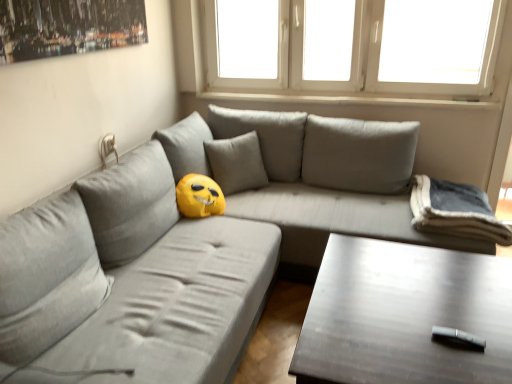
Question: Is gray fabric couch at center positioned with its back to gray fleece blanket at right, positioned as the 2th pillow in left-to-right order?

Choices:
 (A) no
 (B) yes

Answer: (A)

Question: Is gray fabric couch at center further to the viewer compared to gray fleece blanket at right, positioned as the 2th pillow in left-to-right order?

Choices:
 (A) yes
 (B) no

Answer: (B)

Question: Considering the relative positions of gray fabric couch at center and gray fleece blanket at right, the 1th pillow in the right-to-left sequence, in the image provided, is gray fabric couch at center to the left of gray fleece blanket at right, the 1th pillow in the right-to-left sequence, from the viewer's perspective?

Choices:
 (A) yes
 (B) no

Answer: (A)

Question: Considering the relative sizes of gray fabric couch at center and gray fleece blanket at right, the 1th pillow in the right-to-left sequence, in the image provided, is gray fabric couch at center wider than gray fleece blanket at right, the 1th pillow in the right-to-left sequence,?

Choices:
 (A) yes
 (B) no

Answer: (A)

Question: Would you say gray fleece blanket at right, positioned as the 2th pillow in left-to-right order, is part of gray fabric couch at center's contents?

Choices:
 (A) yes
 (B) no

Answer: (A)

Question: Is yellow plush at center, positioned as the second pillow in right-to-left order, to the left or to the right of gray fabric couch at center in the image?

Choices:
 (A) right
 (B) left

Answer: (B)

Question: Is point (207, 145) positioned closer to the camera than point (330, 117)?

Choices:
 (A) closer
 (B) farther

Answer: (A)

Question: Is yellow plush at center, which is the first pillow in left-to-right order, inside the boundaries of gray fabric couch at center, or outside?

Choices:
 (A) inside
 (B) outside

Answer: (A)

Question: In the image, is yellow plush at center, which is the first pillow in left-to-right order, positioned in front of or behind gray fabric couch at center?

Choices:
 (A) behind
 (B) front

Answer: (A)

Question: Would you say yellow plush at center, which is the first pillow in left-to-right order, is to the left or to the right of gray fleece blanket at right, the 1th pillow in the right-to-left sequence, in the picture?

Choices:
 (A) left
 (B) right

Answer: (A)

Question: Which is correct: yellow plush at center, positioned as the second pillow in right-to-left order, is inside gray fleece blanket at right, positioned as the 2th pillow in left-to-right order, or outside of it?

Choices:
 (A) inside
 (B) outside

Answer: (B)

Question: From the image's perspective, relative to gray fleece blanket at right, the 1th pillow in the right-to-left sequence, is yellow plush at center, which is the first pillow in left-to-right order, above or below?

Choices:
 (A) below
 (B) above

Answer: (B)

Question: Is yellow plush at center, positioned as the second pillow in right-to-left order, bigger or smaller than gray fleece blanket at right, the 1th pillow in the right-to-left sequence?

Choices:
 (A) big
 (B) small

Answer: (B)

Question: Would you say white plastic window at upper center is inside or outside yellow plush at center, which is the first pillow in left-to-right order?

Choices:
 (A) outside
 (B) inside

Answer: (A)

Question: Is white plastic window at upper center bigger or smaller than yellow plush at center, positioned as the second pillow in right-to-left order?

Choices:
 (A) big
 (B) small

Answer: (A)